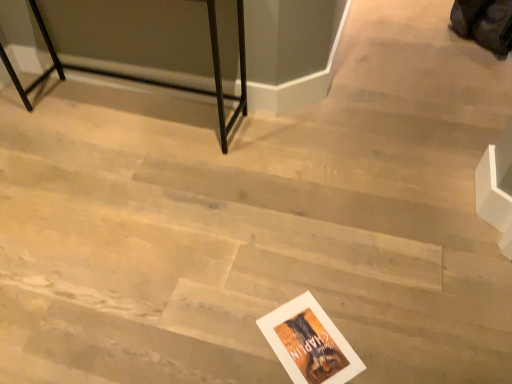
I want to click on vacant area that lies in front of black metal table at upper left, so click(x=112, y=200).